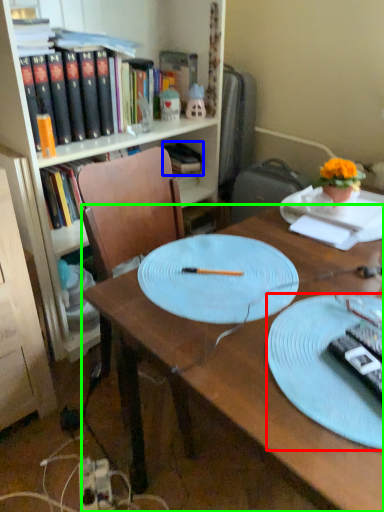
Question: Which object is the farthest from plate (highlighted by a red box)? Choose among these: book (highlighted by a blue box) or desk (highlighted by a green box).

Choices:
 (A) book
 (B) desk

Answer: (A)